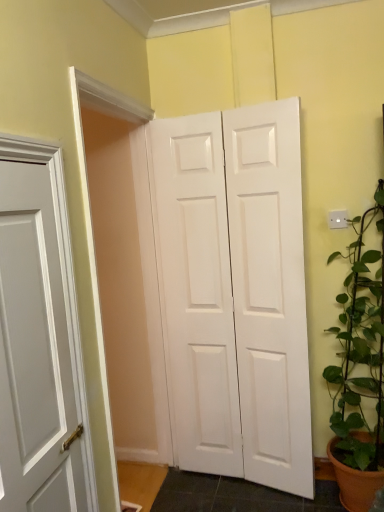
Question: Visually, is green leafy plant at right positioned to the left or to the right of white matte door at center?

Choices:
 (A) left
 (B) right

Answer: (B)

Question: Is green leafy plant at right wider or thinner than white matte door at center?

Choices:
 (A) thin
 (B) wide

Answer: (B)

Question: Considering the positions of point (382, 309) and point (284, 483), is point (382, 309) closer or farther from the camera than point (284, 483)?

Choices:
 (A) farther
 (B) closer

Answer: (B)

Question: From a real-world perspective, is white matte door at center above or below green leafy plant at right?

Choices:
 (A) below
 (B) above

Answer: (B)

Question: From the image's perspective, is white matte door at center located above or below green leafy plant at right?

Choices:
 (A) below
 (B) above

Answer: (B)

Question: From their relative heights in the image, would you say white matte door at center is taller or shorter than green leafy plant at right?

Choices:
 (A) short
 (B) tall

Answer: (B)

Question: Looking at their shapes, would you say white matte door at center is wider or thinner than green leafy plant at right?

Choices:
 (A) thin
 (B) wide

Answer: (A)